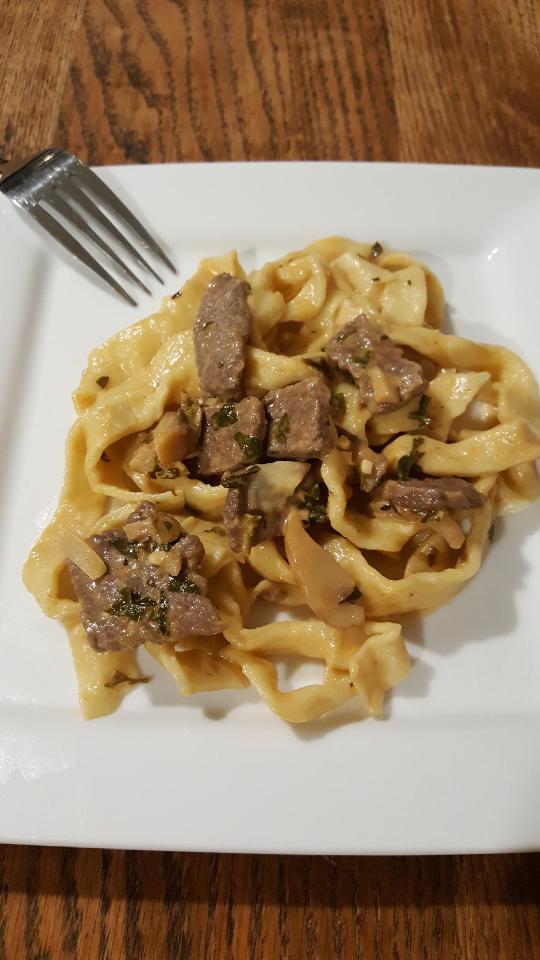
Where is `fork`? This screenshot has height=960, width=540. fork is located at coordinates (131, 227).